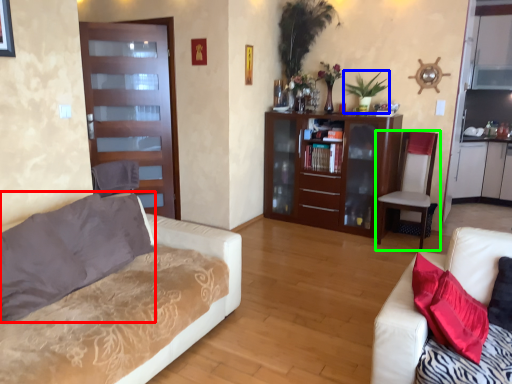
Question: Which is nearer to the pillow (highlighted by a red box)? plant (highlighted by a blue box) or chair (highlighted by a green box).

Choices:
 (A) plant
 (B) chair

Answer: (B)